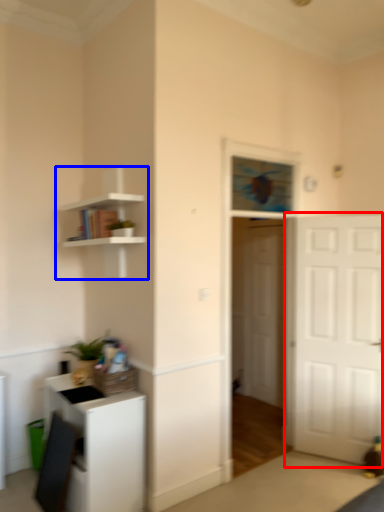
Question: Which object appears closest to the camera in this image, door (highlighted by a red box) or shelf (highlighted by a blue box)?

Choices:
 (A) door
 (B) shelf

Answer: (B)